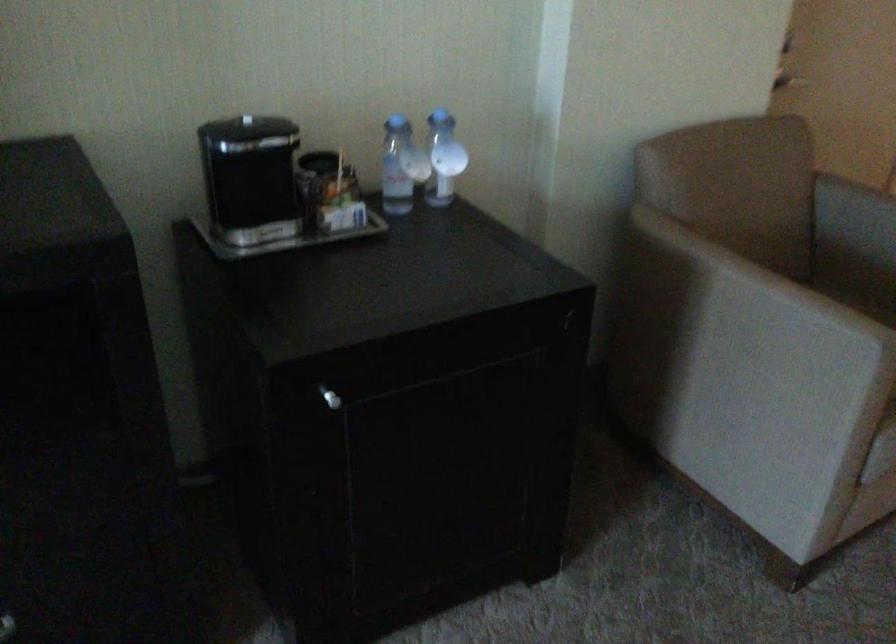
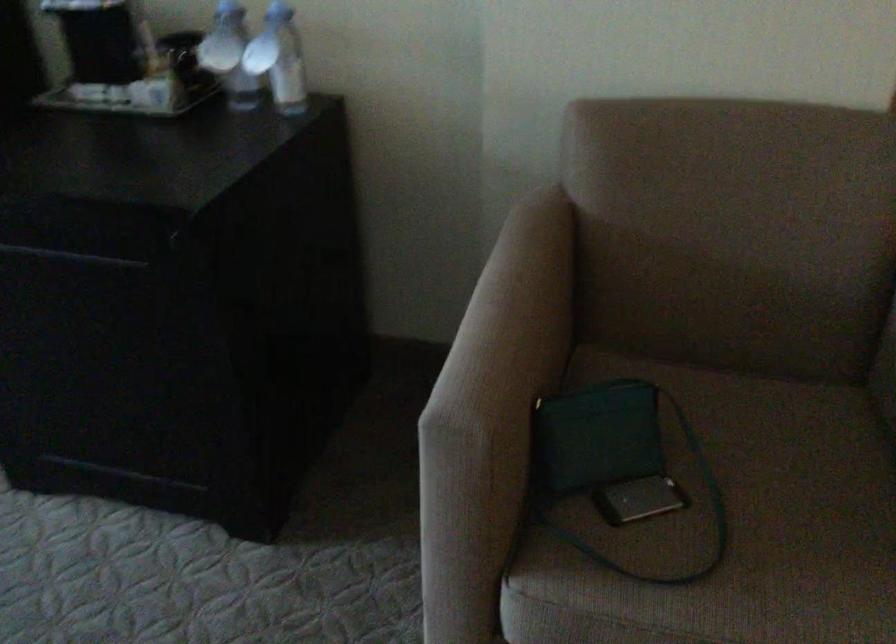
Find the pixel in the second image that matches the point at 440,160 in the first image.

(279, 59)